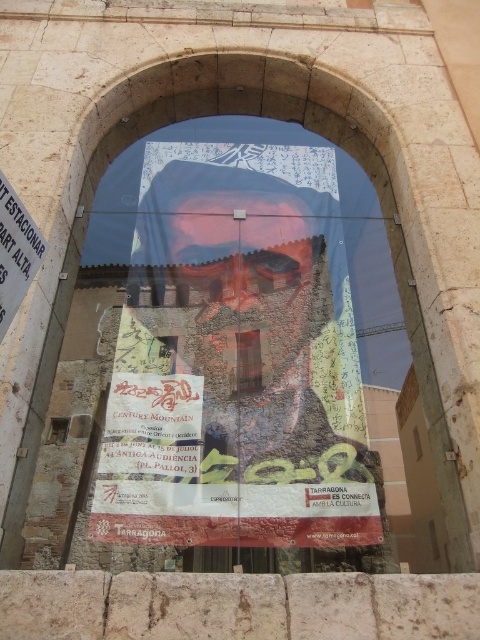
Is point (339, 497) positioned in front of point (13, 228)?

That is False.

Between matte blue poster at center and matte paper poster at center, which one has less height?

Standing shorter between the two is matte paper poster at center.

I want to click on matte blue poster at center, so click(237, 358).